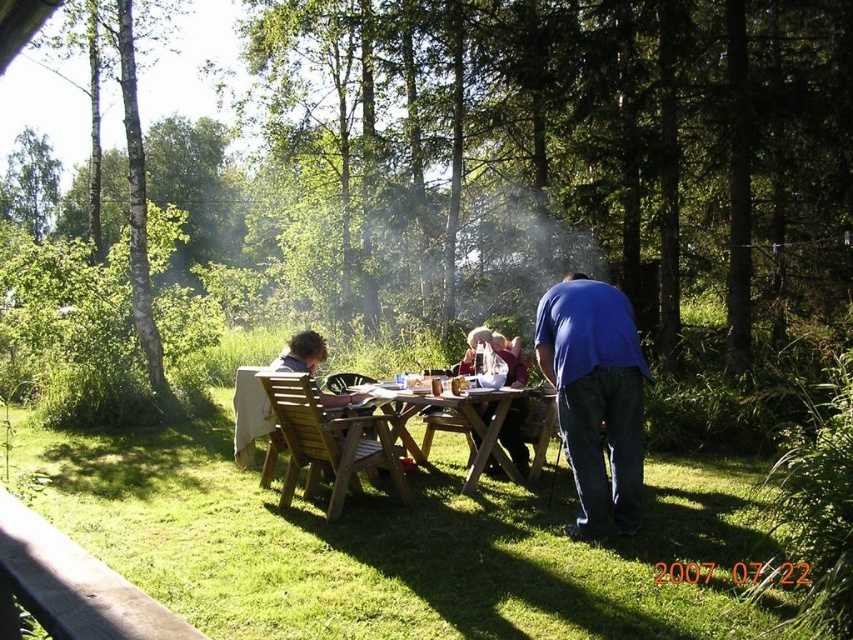
Does point (572, 292) come closer to viewer compared to point (463, 488)?

Yes, it is.

Who is positioned more to the right, wooden table at center or wooden picnic table at center?

Positioned to the right is wooden table at center.

Locate an element on the screen. This screenshot has width=853, height=640. wooden table at center is located at coordinates (595, 397).

Can you confirm if wooden table at center is positioned below blue fabric shirt at right?

Indeed, wooden table at center is positioned under blue fabric shirt at right.

Between point (631, 529) and point (572, 289), which one is positioned in front?

Point (631, 529)

The height and width of the screenshot is (640, 853). Identify the location of wooden table at center. (595, 397).

Who is taller, blue fabric shirt at right or wooden picnic table at center?

blue fabric shirt at right is taller.

Is blue fabric shirt at right thinner than wooden picnic table at center?

Correct, blue fabric shirt at right's width is less than wooden picnic table at center's.

What do you see at coordinates (595, 396) in the screenshot? I see `blue fabric shirt at right` at bounding box center [595, 396].

Identify the location of blue fabric shirt at right. coord(595,396).